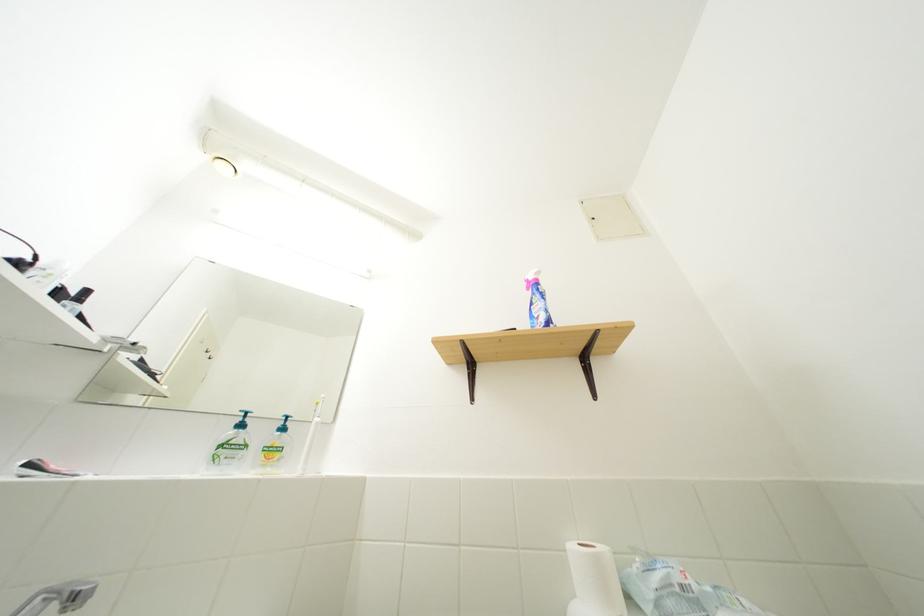
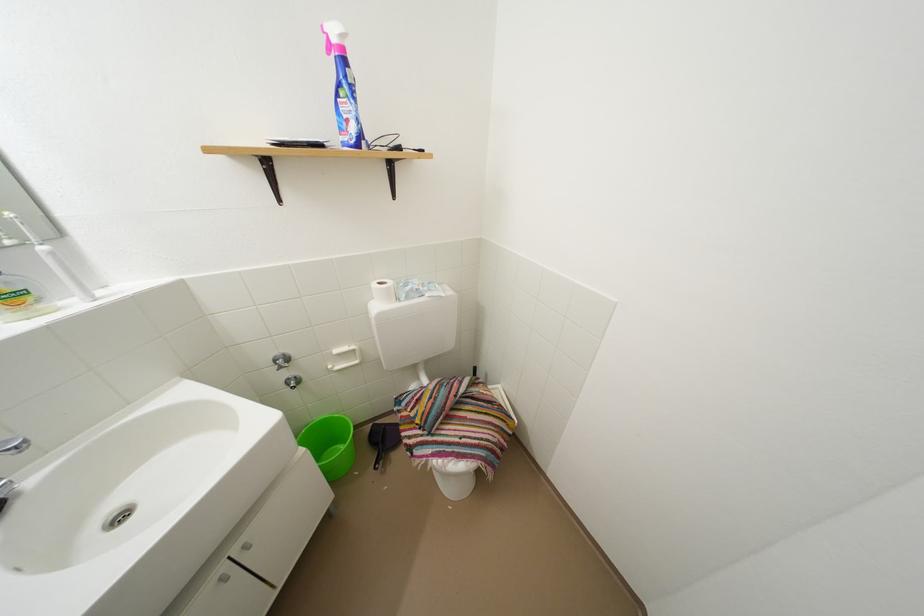
The images are taken continuously from a first-person perspective. In which direction is your viewpoint rotating?

The camera's rotation is toward right-down.